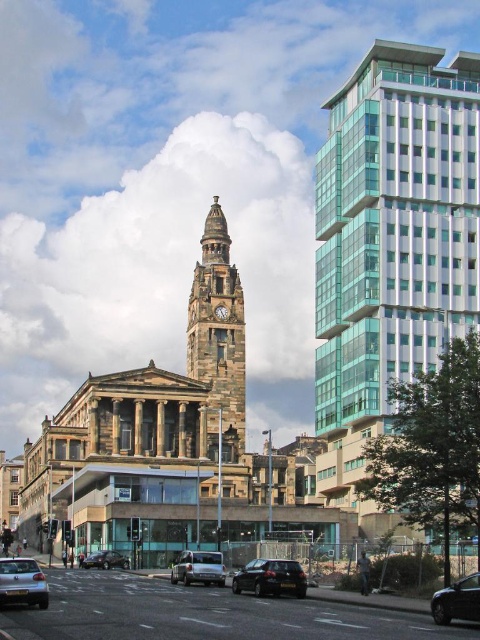
You are standing at the base of the clock tower and looking towards the highrise building. There are two points marked on the image, point A at coordinates point A is point (337,264) and point B is point (235,384). Which point is closer to you?

Point A at coordinates point (337,264) is in front of point B at coordinates point (235,384), so point A is closer to you.

You are standing at a viewpoint where you can see both the glassy teal skyscraper at right and the stone clock tower at center. Which structure appears taller from your vantage point?

The glassy teal skyscraper at right is taller than the stone clock tower at center, so it appears taller from your vantage point.